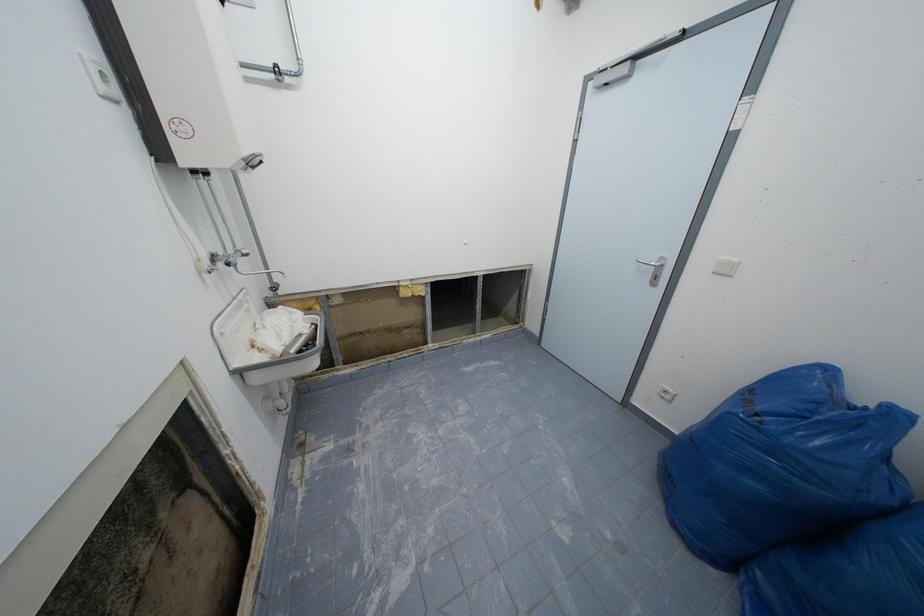
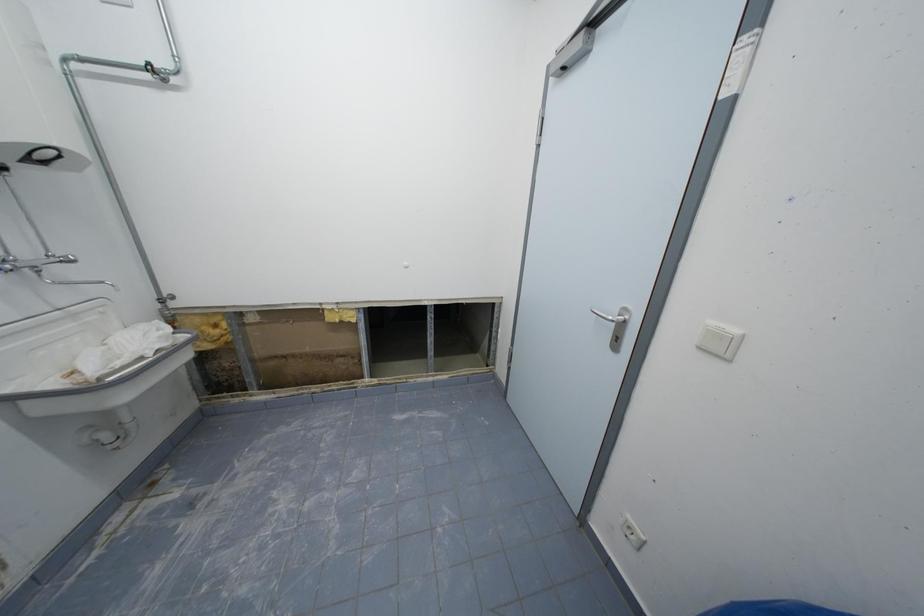
Question: The images are taken continuously from a first-person perspective. In which direction is your viewpoint rotating?

Choices:
 (A) Left
 (B) Right
 (C) Up
 (D) Down

Answer: (A)